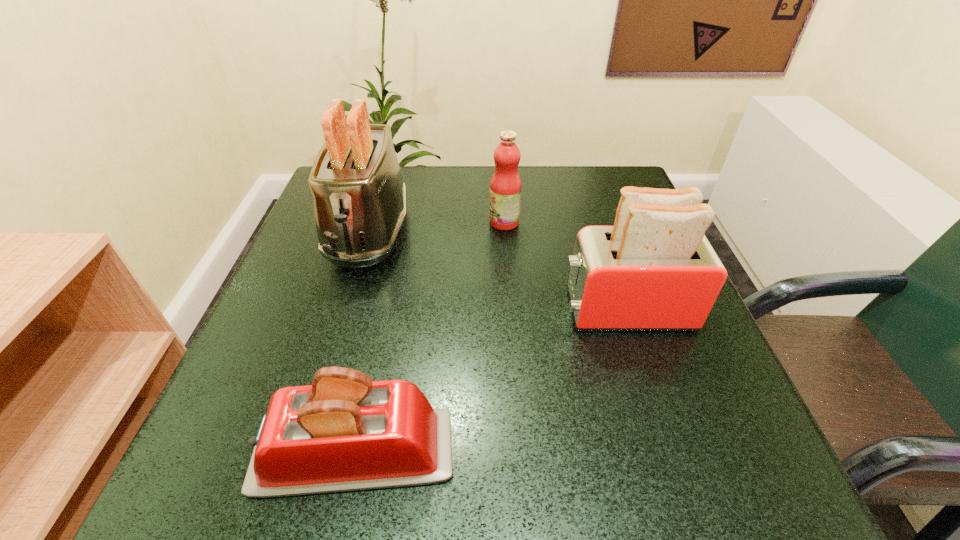
Locate an element on the screen. vacant space in between the rightmost object and the nearest object is located at coordinates click(x=490, y=381).

Identify the location of vacant area that lies between the farthest toaster and the second object from right to left. The image size is (960, 540). (437, 227).

At what (x,y) coordinates should I click in order to perform the action: click on vacant point located between the farthest toaster and the fruit juice. Please return your answer as a coordinate pair (x, y). The height and width of the screenshot is (540, 960). Looking at the image, I should click on (437, 227).

The image size is (960, 540). Find the location of `free point between the fruit juice and the nearest toaster`. free point between the fruit juice and the nearest toaster is located at coordinates (429, 338).

What are the coordinates of `vacant area between the nearest object and the second shortest toaster` in the screenshot? It's located at (490, 381).

Image resolution: width=960 pixels, height=540 pixels. I want to click on object that is the third nearest to the nearest toaster, so click(x=505, y=187).

Identify which object is the nearest to the farthest toaster. Please provide its 2D coordinates. Your answer should be formatted as a tuple, i.e. [(x, y)], where the tuple contains the x and y coordinates of a point satisfying the conditions above.

[(505, 187)]

Select which toaster appears as the second closest to the second object from right to left. Please provide its 2D coordinates. Your answer should be formatted as a tuple, i.e. [(x, y)], where the tuple contains the x and y coordinates of a point satisfying the conditions above.

[(654, 270)]

The width and height of the screenshot is (960, 540). In order to click on the closest toaster to the nearest object in this screenshot , I will do `click(654, 270)`.

What are the coordinates of `free space that satisfies the following two spatial constraints: 1. on the side of the nearest object with the control lever; 2. on the left side of the farthest toaster` in the screenshot? It's located at (303, 452).